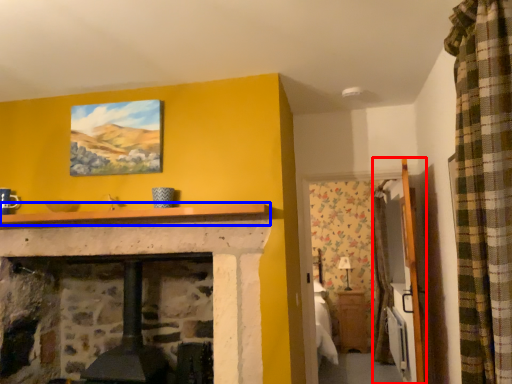
Question: Which object is closer to the camera taking this photo, armoire (highlighted by a red box) or mantle (highlighted by a blue box)?

Choices:
 (A) armoire
 (B) mantle

Answer: (B)